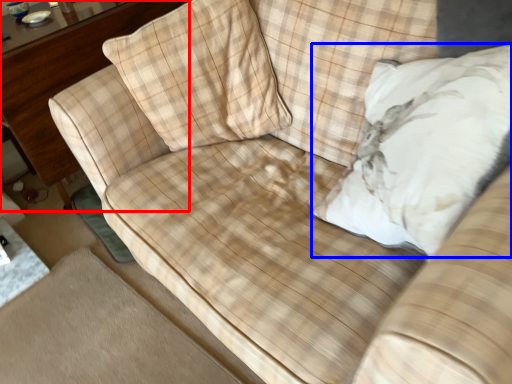
Question: Which object is further to the camera taking this photo, dresser (highlighted by a red box) or throw pillow (highlighted by a blue box)?

Choices:
 (A) dresser
 (B) throw pillow

Answer: (A)